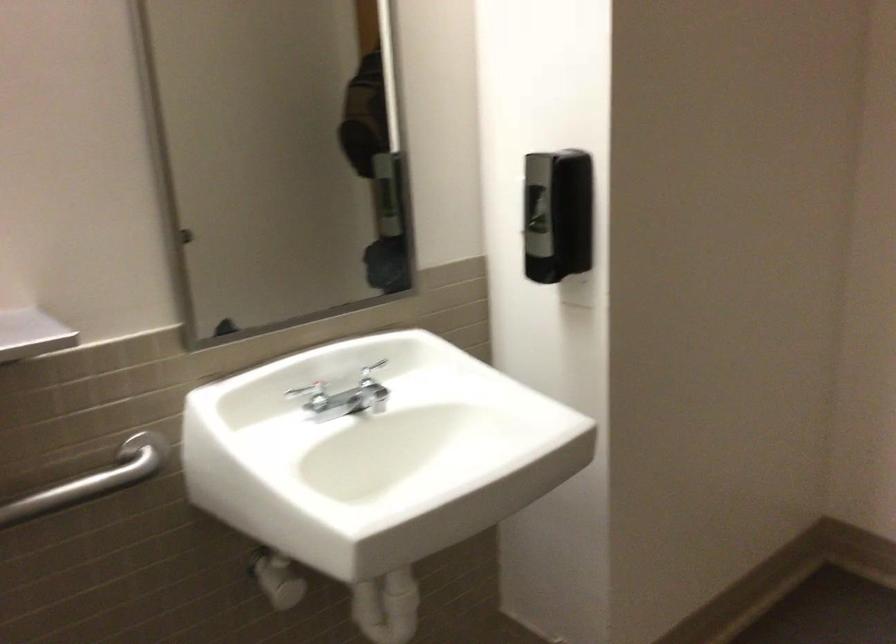
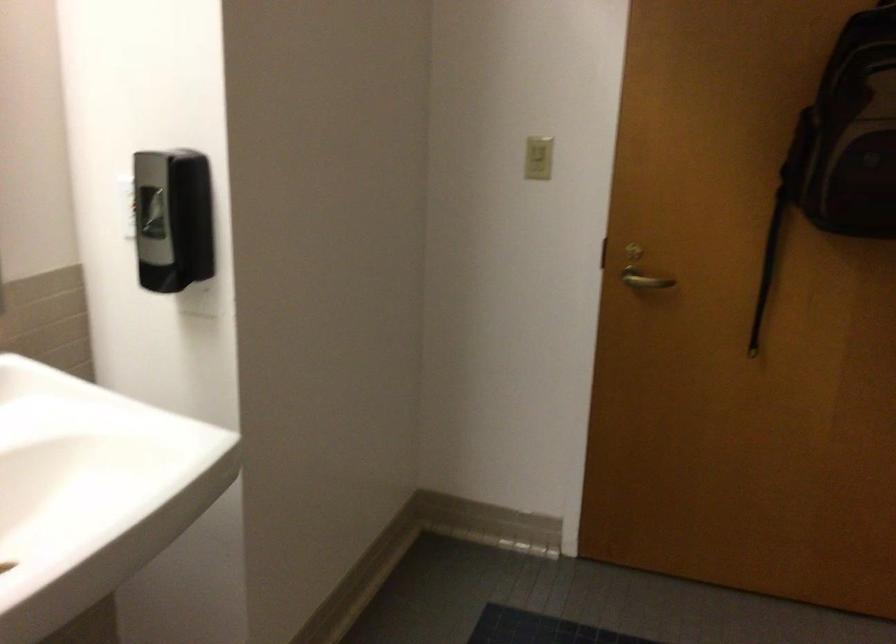
Question: The first image is from the beginning of the video and the second image is from the end. How did the camera likely rotate when shooting the video?

Choices:
 (A) Left
 (B) Right
 (C) Up
 (D) Down

Answer: (B)